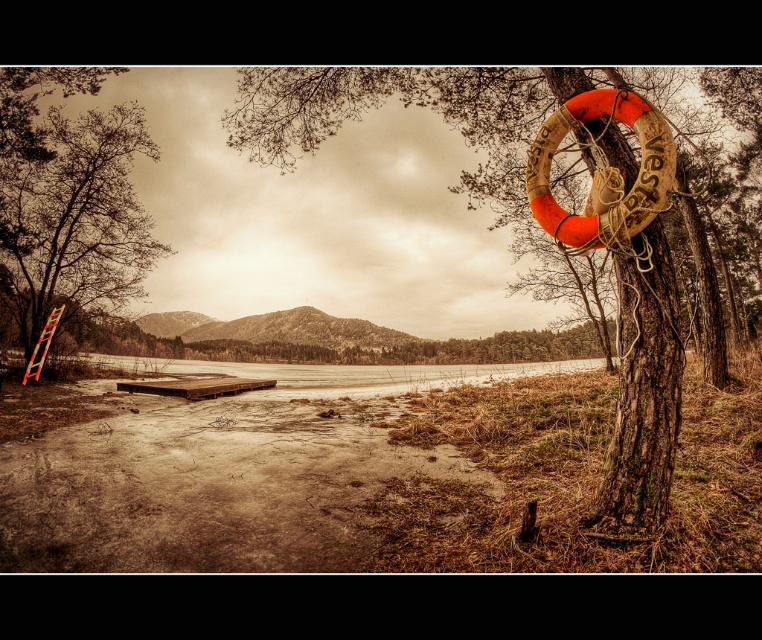
Question: Which of the following is the farthest from the observer?

Choices:
 (A) brown rough ladder at left
 (B) wooden textured tree trunk at right

Answer: (A)

Question: Does wooden textured tree trunk at right lie in front of brown rough ladder at left?

Choices:
 (A) yes
 (B) no

Answer: (A)

Question: Where is wooden textured tree trunk at right located in relation to brown rough ladder at left in the image?

Choices:
 (A) below
 (B) above

Answer: (A)

Question: Does wooden textured tree trunk at right have a lesser width compared to brown rough ladder at left?

Choices:
 (A) yes
 (B) no

Answer: (B)

Question: Which point is closer to the camera?

Choices:
 (A) click(x=271, y=128)
 (B) click(x=155, y=248)

Answer: (A)

Question: Which point is closer to the camera?

Choices:
 (A) (578, 156)
 (B) (101, 186)

Answer: (A)